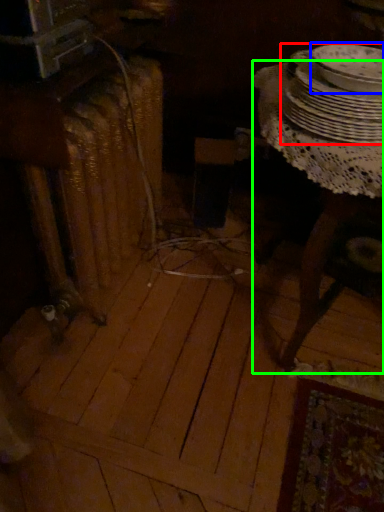
Question: Which is farther away from tableware (highlighted by a red box)? tableware (highlighted by a blue box) or table (highlighted by a green box)?

Choices:
 (A) tableware
 (B) table

Answer: (B)